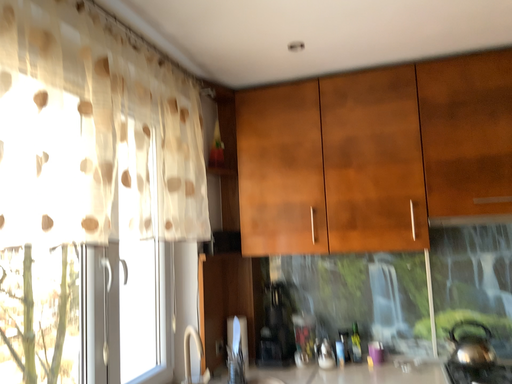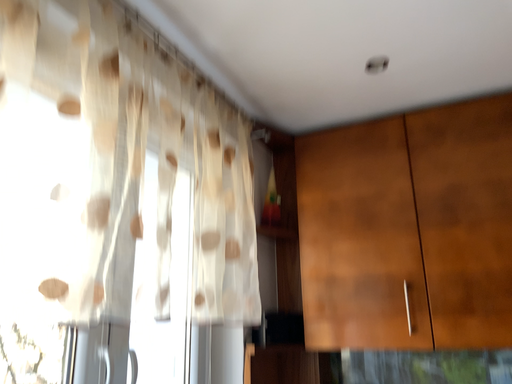
Question: How did the camera likely rotate when shooting the video?

Choices:
 (A) rotated downward
 (B) rotated upward

Answer: (B)